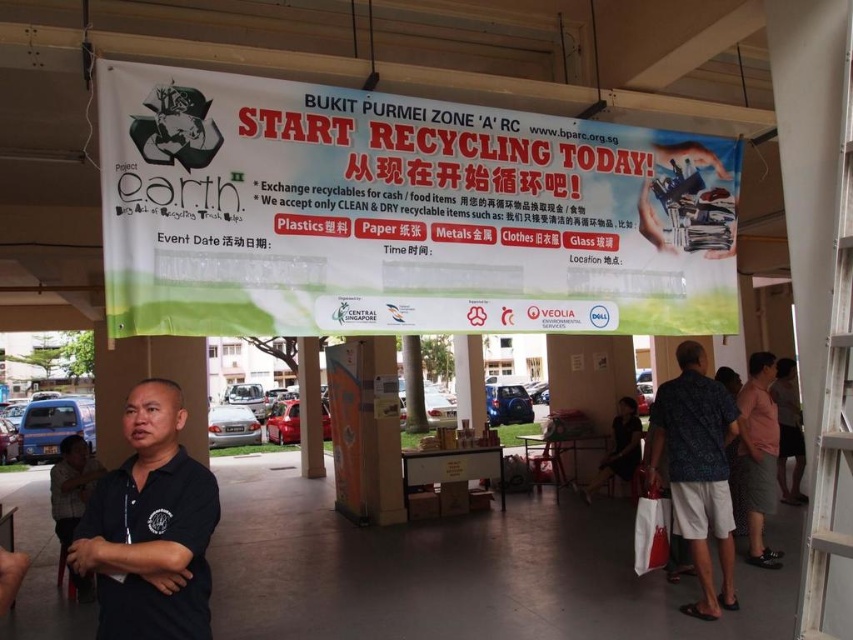
Based on the photo, you are organizing a recycling event and need to display two shirts as examples of recyclable clothing items. The printed fabric shirt at right and the dark gray shirt at lower left are available. Which shirt should you choose to place on the main display table if you want the larger one to attract more attention?

The printed fabric shirt at right is larger in size than the dark gray shirt at lower left, so you should choose the printed fabric shirt at right for the main display table to attract more attention.

You are organizing a clothing donation drive and need to arrange shirts on a rack. You have a printed fabric shirt at right and a dark gray fabric shirt at center. According to the setup, which shirt should be placed to the left of the other?

The printed fabric shirt at right should be placed to the left of the dark gray fabric shirt at center because it is positioned on the left side of it in the setup.

You are organizing a clothing donation drive and need to display two shirts, the printed fabric shirt at right and the dark gray fabric shirt at center. Which shirt should you choose to place on a higher shelf to make it more visible?

The printed fabric shirt at right has a greater height compared to the dark gray fabric shirt at center, so placing it on a higher shelf would make it more visible since its taller size can stand out better from a distance.